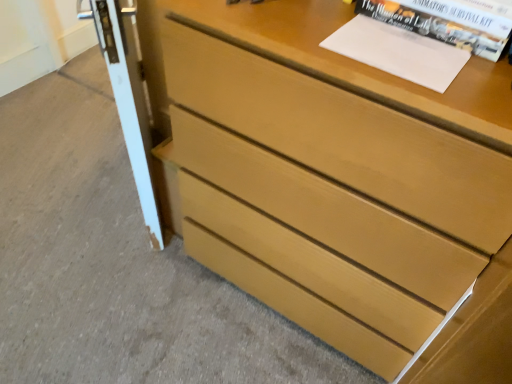
The height and width of the screenshot is (384, 512). Find the location of `vacant space situated above light brown wood chest of drawers at center (from a real-world perspective)`. vacant space situated above light brown wood chest of drawers at center (from a real-world perspective) is located at coordinates (395, 44).